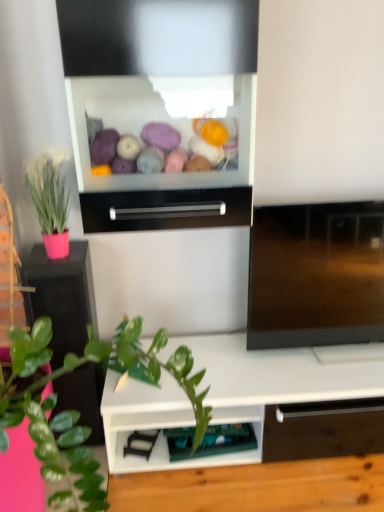
Question: Can you confirm if matte pink pot at left is bigger than green plastic shelf at lower center?

Choices:
 (A) yes
 (B) no

Answer: (A)

Question: Is matte pink pot at left behind green plastic shelf at lower center?

Choices:
 (A) no
 (B) yes

Answer: (A)

Question: Is matte pink pot at left thinner than green plastic shelf at lower center?

Choices:
 (A) yes
 (B) no

Answer: (B)

Question: Can you confirm if matte pink pot at left is wider than green plastic shelf at lower center?

Choices:
 (A) yes
 (B) no

Answer: (A)

Question: Would you say matte pink pot at left contains green plastic shelf at lower center?

Choices:
 (A) yes
 (B) no

Answer: (B)

Question: From their relative heights in the image, would you say green plastic shelf at lower center is taller or shorter than matte pink pot at left?

Choices:
 (A) short
 (B) tall

Answer: (A)

Question: From the image's perspective, is green plastic shelf at lower center positioned above or below matte pink pot at left?

Choices:
 (A) below
 (B) above

Answer: (A)

Question: Relative to matte pink pot at left, is green plastic shelf at lower center in front or behind?

Choices:
 (A) behind
 (B) front

Answer: (A)

Question: In terms of width, does green plastic shelf at lower center look wider or thinner when compared to matte pink pot at left?

Choices:
 (A) wide
 (B) thin

Answer: (B)

Question: Looking at their shapes, would you say pink matte plant pot at left is wider or thinner than matte pink pot at left?

Choices:
 (A) wide
 (B) thin

Answer: (A)

Question: Is pink matte plant pot at left in front of or behind matte pink pot at left in the image?

Choices:
 (A) front
 (B) behind

Answer: (B)

Question: Considering the relative positions of pink matte plant pot at left and matte pink pot at left in the image provided, is pink matte plant pot at left to the left or to the right of matte pink pot at left?

Choices:
 (A) right
 (B) left

Answer: (A)

Question: From a real-world perspective, relative to matte pink pot at left, is pink matte plant pot at left vertically above or below?

Choices:
 (A) below
 (B) above

Answer: (A)

Question: Is pink matte plant pot at left inside the boundaries of green plastic shelf at lower center, or outside?

Choices:
 (A) outside
 (B) inside

Answer: (A)

Question: Considering the positions of pink matte plant pot at left and green plastic shelf at lower center in the image, is pink matte plant pot at left taller or shorter than green plastic shelf at lower center?

Choices:
 (A) tall
 (B) short

Answer: (A)